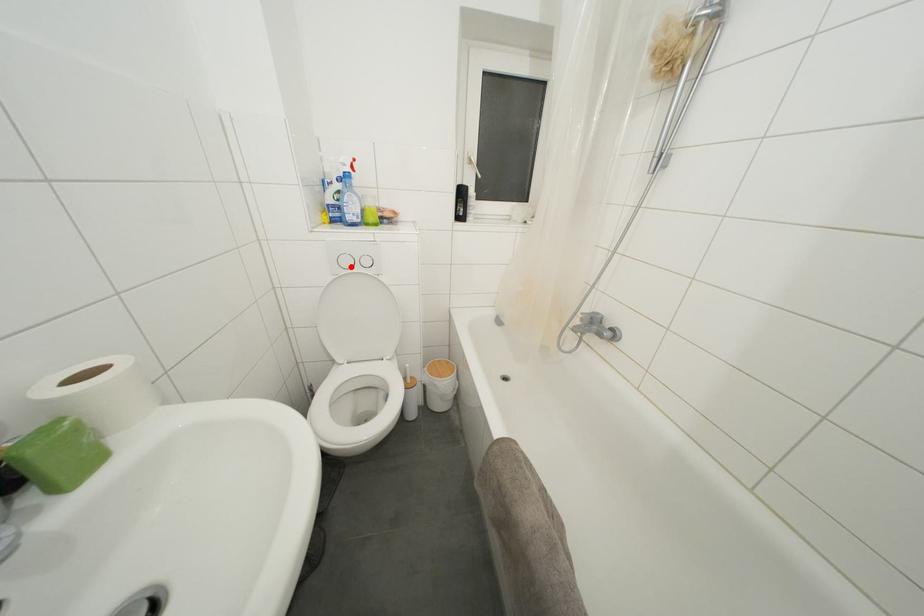
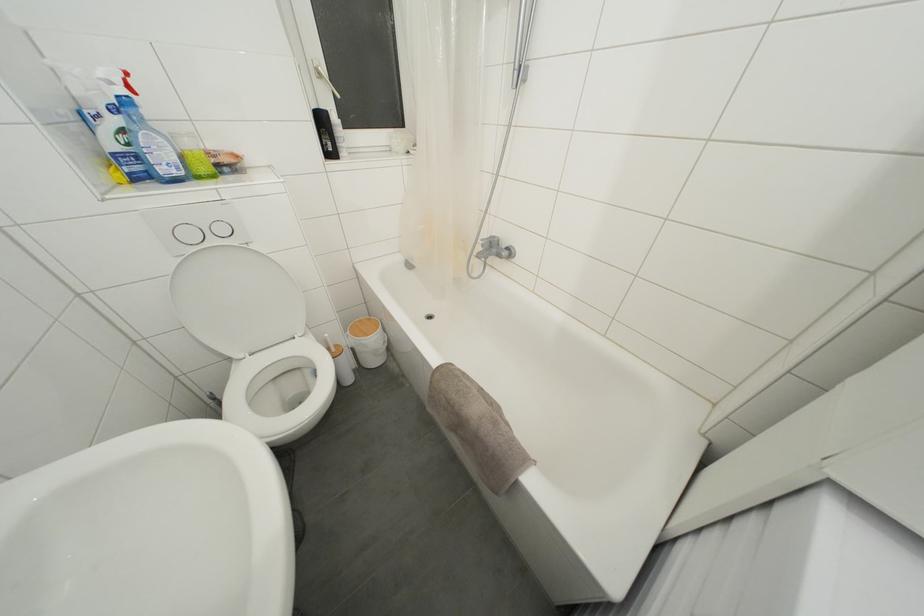
Find the pixel in the second image that matches the highlighted location in the first image.

(195, 240)